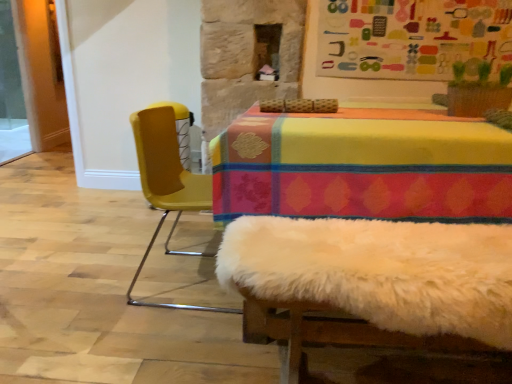
Locate an element on the screen. transparent glass screen door at left is located at coordinates (13, 89).

This screenshot has width=512, height=384. Describe the element at coordinates (13, 89) in the screenshot. I see `transparent glass screen door at left` at that location.

Image resolution: width=512 pixels, height=384 pixels. Identify the location of yellow plastic chair at left. (167, 184).

From a real-world perspective, who is located higher, transparent glass screen door at left or multicolored fabric bulletin board at upper center?

multicolored fabric bulletin board at upper center is physically above.

From the image's perspective, is transparent glass screen door at left below multicolored fabric bulletin board at upper center?

Incorrect, from the image's perspective, transparent glass screen door at left is higher than multicolored fabric bulletin board at upper center.

Does point (12, 102) come behind point (351, 26)?

That is True.

In the scene shown: Which object is positioned more to the left, yellow plastic chair at left or transparent glass screen door at left?

transparent glass screen door at left is more to the left.

Which is correct: yellow plastic chair at left is inside transparent glass screen door at left, or outside of it?

yellow plastic chair at left cannot be found inside transparent glass screen door at left.

In the scene shown: What's the angular difference between yellow plastic chair at left and transparent glass screen door at left's facing directions?

The angle between the facing direction of yellow plastic chair at left and the facing direction of transparent glass screen door at left is 0.412 degrees.

From the image's perspective, is yellow plastic chair at left located above or below transparent glass screen door at left?

yellow plastic chair at left is below transparent glass screen door at left.

Considering the sizes of objects transparent glass screen door at left and yellow plastic chair at left in the image provided, who is bigger, transparent glass screen door at left or yellow plastic chair at left?

With larger size is yellow plastic chair at left.

The height and width of the screenshot is (384, 512). Find the location of `screen door behind the yellow plastic chair at left`. screen door behind the yellow plastic chair at left is located at coordinates (13, 89).

In terms of width, does transparent glass screen door at left look wider or thinner when compared to yellow plastic chair at left?

Considering their sizes, transparent glass screen door at left looks slimmer than yellow plastic chair at left.

Consider the image. From the image's perspective, is transparent glass screen door at left above yellow plastic chair at left?

Yes, from the image's perspective, transparent glass screen door at left is on top of yellow plastic chair at left.

Identify the location of bulletin board behind the yellow plastic chair at left. The image size is (512, 384). (412, 38).

From the image's perspective, is yellow plastic chair at left positioned above or below multicolored fabric bulletin board at upper center?

yellow plastic chair at left is situated lower than multicolored fabric bulletin board at upper center in the image.

Visually, is yellow plastic chair at left positioned to the left or to the right of multicolored fabric bulletin board at upper center?

Clearly, yellow plastic chair at left is on the left of multicolored fabric bulletin board at upper center in the image.

Could multicolored fabric bulletin board at upper center be considered to be inside yellow plastic chair at left?

No, multicolored fabric bulletin board at upper center is not inside yellow plastic chair at left.

Considering the relative sizes of multicolored fabric bulletin board at upper center and yellow plastic chair at left in the image provided, is multicolored fabric bulletin board at upper center bigger than yellow plastic chair at left?

Incorrect, multicolored fabric bulletin board at upper center is not larger than yellow plastic chair at left.

From a real-world perspective, is multicolored fabric bulletin board at upper center above or below yellow plastic chair at left?

In terms of real-world spatial position, multicolored fabric bulletin board at upper center is above yellow plastic chair at left.

From the picture: How many degrees apart are the facing directions of multicolored fabric bulletin board at upper center and yellow plastic chair at left?

They differ by 88.7 degrees in their facing directions.

Based on the photo, would you say multicolored fabric bulletin board at upper center is a long distance from yellow plastic chair at left?

Indeed, multicolored fabric bulletin board at upper center is not near yellow plastic chair at left.

Can you tell me how much multicolored fabric bulletin board at upper center and transparent glass screen door at left differ in facing direction?

The facing directions of multicolored fabric bulletin board at upper center and transparent glass screen door at left are 89.1 degrees apart.

Looking at the image, does multicolored fabric bulletin board at upper center seem bigger or smaller compared to transparent glass screen door at left?

Clearly, multicolored fabric bulletin board at upper center is smaller in size than transparent glass screen door at left.

Locate an element on the screen. The image size is (512, 384). bulletin board to the right of transparent glass screen door at left is located at coordinates (412, 38).

Can you confirm if multicolored fabric bulletin board at upper center is positioned to the left of transparent glass screen door at left?

No.

In the image, there is a multicolored fabric bulletin board at upper center. Identify the location of screen door above it (from the image's perspective). (13, 89).

Locate an element on the screen. The image size is (512, 384). chair below the transparent glass screen door at left (from a real-world perspective) is located at coordinates (167, 184).

Consider the image. Estimate the real-world distances between objects in this image. Which object is closer to transparent glass screen door at left, yellow plastic chair at left or multicolored fabric bulletin board at upper center?

yellow plastic chair at left is closer to transparent glass screen door at left.

Estimate the real-world distances between objects in this image. Which object is further from multicolored fabric bulletin board at upper center, transparent glass screen door at left or yellow plastic chair at left?

transparent glass screen door at left is positioned further to the anchor multicolored fabric bulletin board at upper center.

Considering their positions, is yellow plastic chair at left positioned further to multicolored fabric bulletin board at upper center than transparent glass screen door at left?

transparent glass screen door at left is further to multicolored fabric bulletin board at upper center.

When comparing their distances from transparent glass screen door at left, does multicolored fabric bulletin board at upper center or yellow plastic chair at left seem further?

Based on the image, multicolored fabric bulletin board at upper center appears to be further to transparent glass screen door at left.

Based on their spatial positions, is multicolored fabric bulletin board at upper center or transparent glass screen door at left further from yellow plastic chair at left?

The object further to yellow plastic chair at left is transparent glass screen door at left.

Estimate the real-world distances between objects in this image. Which object is further from yellow plastic chair at left, transparent glass screen door at left or multicolored fabric bulletin board at upper center?

transparent glass screen door at left is further to yellow plastic chair at left.

Where is `chair between transparent glass screen door at left and multicolored fabric bulletin board at upper center from left to right`? chair between transparent glass screen door at left and multicolored fabric bulletin board at upper center from left to right is located at coordinates (167, 184).